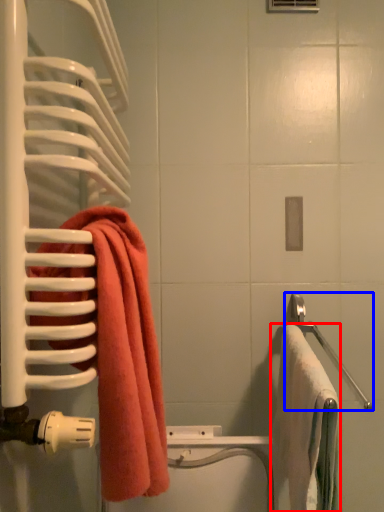
Question: Which object appears farthest to the camera in this image, towel (highlighted by a red box) or towel bar (highlighted by a blue box)?

Choices:
 (A) towel
 (B) towel bar

Answer: (B)